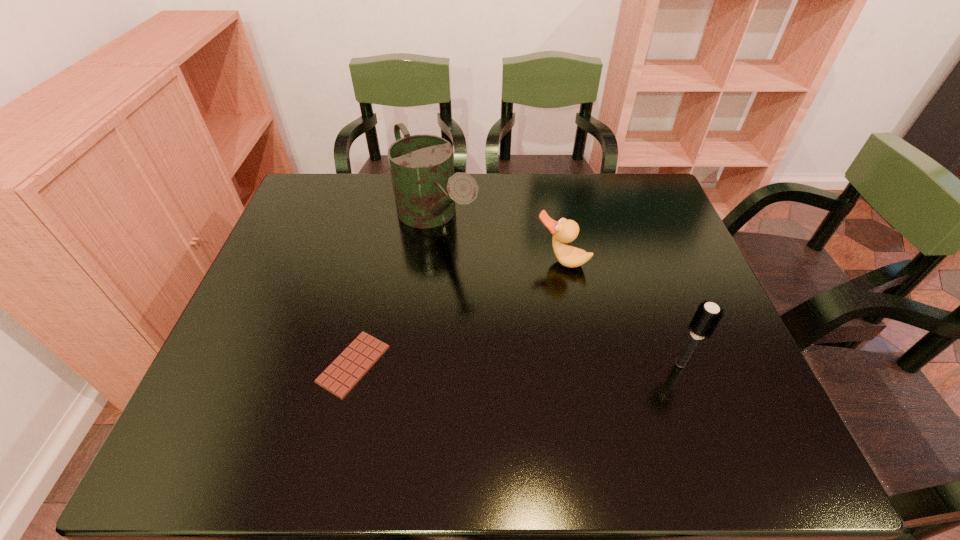
You are a GUI agent. You are given a task and a screenshot of the screen. Output one action in this format:
    pyautogui.click(x=<x>, y=<y>)
    Task: Click on the free space on the desktop that is between the shortest object and the rightmost object and is positioned with the spout on the tallest object
    The image size is (960, 540).
    Given the screenshot: What is the action you would take?
    pyautogui.click(x=555, y=364)

At what (x,y) coordinates should I click in order to perform the action: click on free space on the desktop that is between the candy bar and the rightmost object and is positioned on the beak of the duck. Please return your answer as a coordinate pair (x, y). This screenshot has height=540, width=960. Looking at the image, I should click on (502, 364).